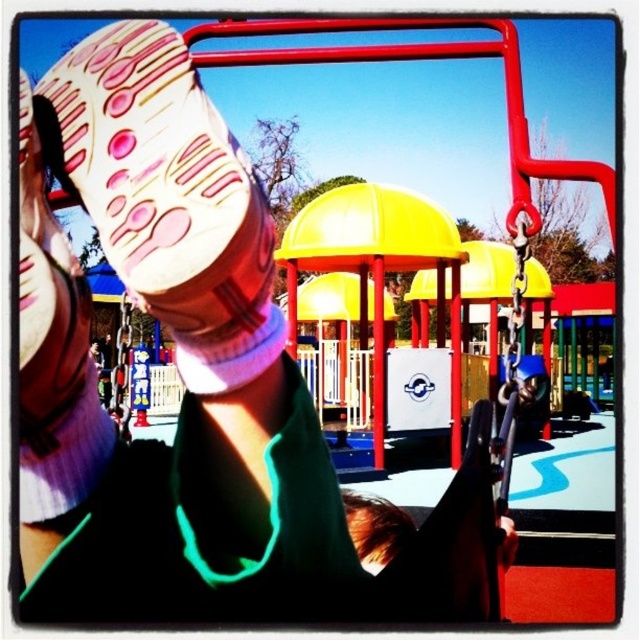
Question: Which of the following is the farthest from the observer?

Choices:
 (A) (246, 278)
 (B) (394, 525)

Answer: (B)

Question: Does pink fabric sock at upper left appear under brown hair at lower center?

Choices:
 (A) no
 (B) yes

Answer: (A)

Question: Can you confirm if pink fabric sock at upper left is wider than brown hair at lower center?

Choices:
 (A) no
 (B) yes

Answer: (B)

Question: Can you confirm if pink fabric sock at upper left is thinner than brown hair at lower center?

Choices:
 (A) no
 (B) yes

Answer: (A)

Question: Which point is farther to the camera?

Choices:
 (A) (380, 552)
 (B) (164, 161)

Answer: (A)